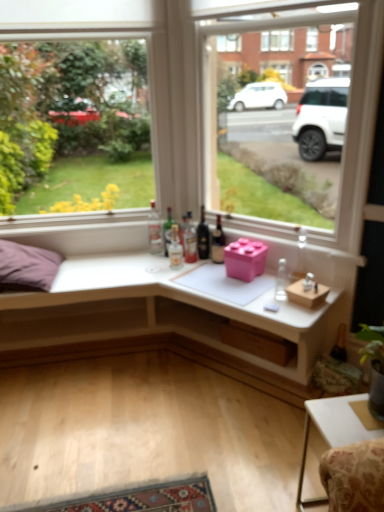
This screenshot has width=384, height=512. Identify the location of free space above white glossy table at lower right (from a real-world perspective). (352, 422).